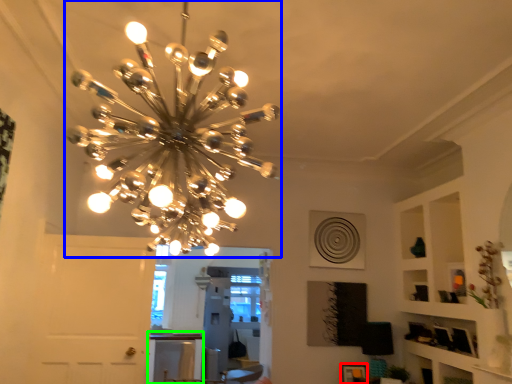
Question: Estimate the real-world distances between objects in this image. Which object is closer to picture frame (highlighted by a red box), lamp (highlighted by a blue box) or table (highlighted by a green box)?

Choices:
 (A) lamp
 (B) table

Answer: (A)